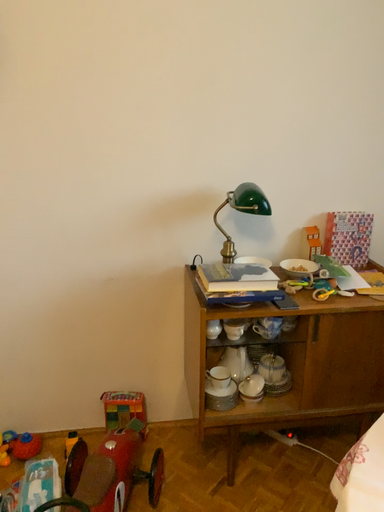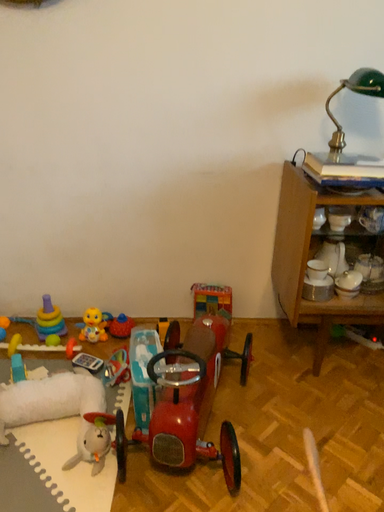
Question: Which way did the camera rotate in the video?

Choices:
 (A) rotated downward
 (B) rotated upward

Answer: (A)